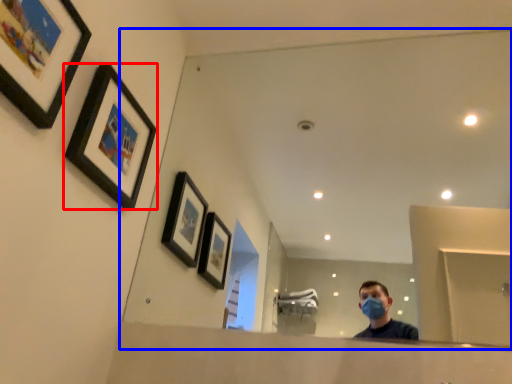
Question: Which point is further to the camera, picture frame (highlighted by a red box) or mirror (highlighted by a blue box)?

Choices:
 (A) picture frame
 (B) mirror

Answer: (A)